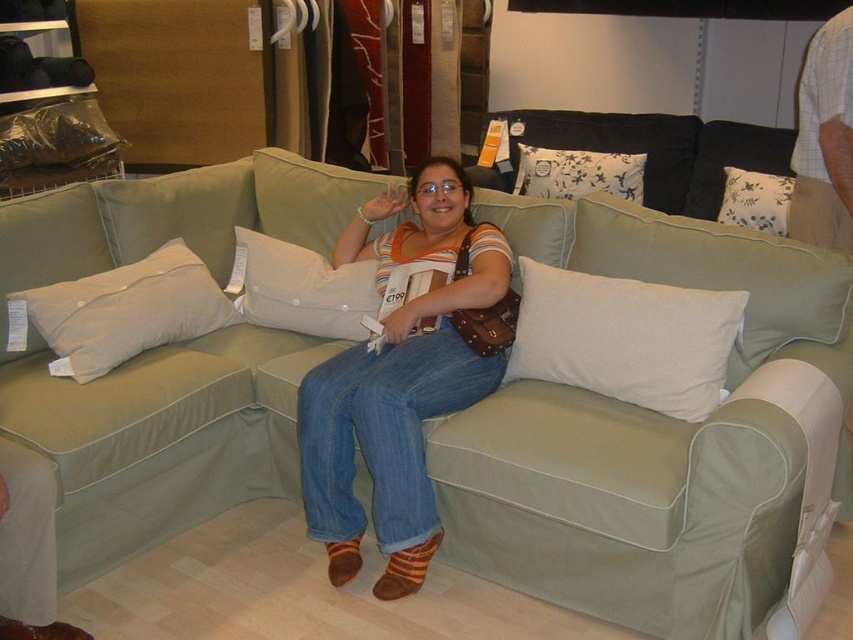
Question: Is white printed fabric pillow at center wider than white floral fabric pillow at upper right?

Choices:
 (A) no
 (B) yes

Answer: (B)

Question: Is beige fabric pillow at center thinner than white floral fabric pillow at upper right?

Choices:
 (A) yes
 (B) no

Answer: (B)

Question: Which is farther from the denim jeans at center?

Choices:
 (A) beige fabric pillow at left
 (B) beige fabric pillow at center
 (C) white printed fabric pillow at center

Answer: (C)

Question: Which point is farther to the camera?

Choices:
 (A) white printed fabric pillow at center
 (B) white floral fabric pillow at upper right

Answer: (A)

Question: Is beige fabric pillow at center to the left of white printed fabric pillow at center from the viewer's perspective?

Choices:
 (A) no
 (B) yes

Answer: (B)

Question: Among these objects, which one is nearest to the camera?

Choices:
 (A) denim jeans at center
 (B) white printed fabric pillow at center

Answer: (A)